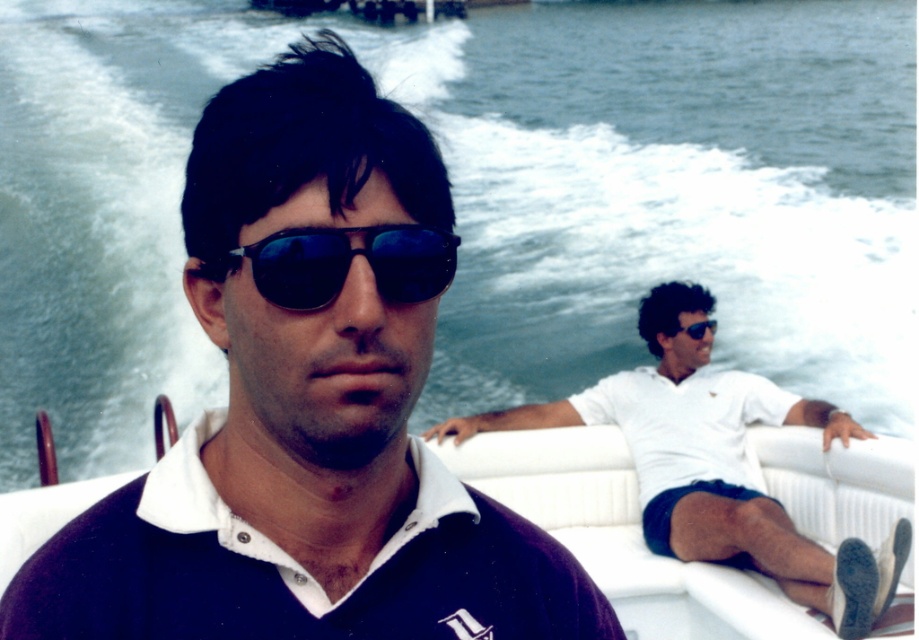
Where is `matte black sunglasses at center`? This screenshot has width=919, height=640. matte black sunglasses at center is located at coordinates (308, 406).

Is matte black sunglasses at center thinner than navy blue cotton polo shirt at center?

In fact, matte black sunglasses at center might be wider than navy blue cotton polo shirt at center.

Is point (413, 348) farther from viewer compared to point (440, 564)?

No.

You are a GUI agent. You are given a task and a screenshot of the screen. Output one action in this format:
    pyautogui.click(x=<x>, y=<y>)
    Task: Click on the matte black sunglasses at center
    
    Given the screenshot: What is the action you would take?
    pyautogui.click(x=308, y=406)

Does white matte shirt at right appear over black reflective sunglasses at upper center?

No.

Can you confirm if white matte shirt at right is positioned below black reflective sunglasses at upper center?

Indeed, white matte shirt at right is positioned under black reflective sunglasses at upper center.

Between point (770, 385) and point (700, 336), which one is positioned in front?

Point (770, 385) is in front.

Where is `white matte shirt at right`? white matte shirt at right is located at coordinates (716, 465).

Is navy blue cotton polo shirt at center to the left of white matte polo shirt at right from the viewer's perspective?

Indeed, navy blue cotton polo shirt at center is positioned on the left side of white matte polo shirt at right.

Is navy blue cotton polo shirt at center thinner than white matte polo shirt at right?

Correct, navy blue cotton polo shirt at center's width is less than white matte polo shirt at right's.

Based on the photo, who is more distant from viewer, (120, 540) or (746, 472)?

The point (746, 472) is behind.

Find the location of a particular element. This screenshot has height=640, width=919. navy blue cotton polo shirt at center is located at coordinates (297, 570).